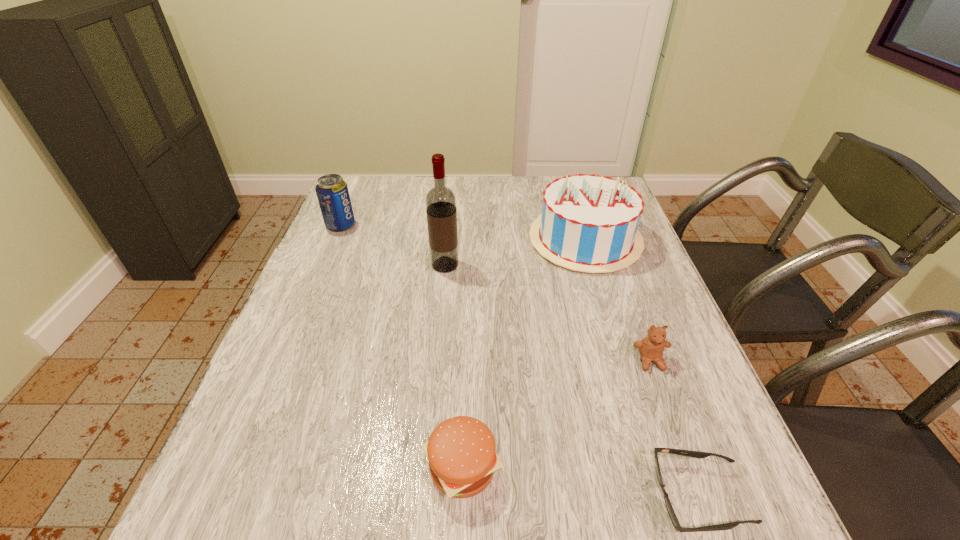
Identify the location of empty space between the third nearest object and the shortest object. This screenshot has height=540, width=960. (675, 429).

Image resolution: width=960 pixels, height=540 pixels. I want to click on free spot between the leftmost object and the teddy bear, so click(495, 293).

The width and height of the screenshot is (960, 540). What are the coordinates of `free spot between the third nearest object and the fifth tallest object` in the screenshot? It's located at (557, 414).

This screenshot has height=540, width=960. Find the location of `free space between the wine bottle and the shortest object`. free space between the wine bottle and the shortest object is located at coordinates (572, 381).

This screenshot has height=540, width=960. Find the location of `vacant region between the shortest object and the fourth farthest object`. vacant region between the shortest object and the fourth farthest object is located at coordinates (675, 429).

The height and width of the screenshot is (540, 960). Find the location of `vacant area that lies between the leftmost object and the second tallest object`. vacant area that lies between the leftmost object and the second tallest object is located at coordinates tap(463, 232).

At what (x,y) coordinates should I click in order to perform the action: click on vacant region between the teddy bear and the tallest object. Please return your answer as a coordinate pair (x, y). This screenshot has width=960, height=540. Looking at the image, I should click on (547, 313).

Identify the location of free space that is in between the hamburger and the fifth shortest object. The width and height of the screenshot is (960, 540). (524, 353).

Identify the location of empty space between the hamburger and the teddy bear. (557, 414).

You are a GUI agent. You are given a task and a screenshot of the screen. Output one action in this format:
    pyautogui.click(x=<x>, y=<y>)
    Task: Click on the closest object to the second shortest object
    
    Given the screenshot: What is the action you would take?
    click(696, 454)